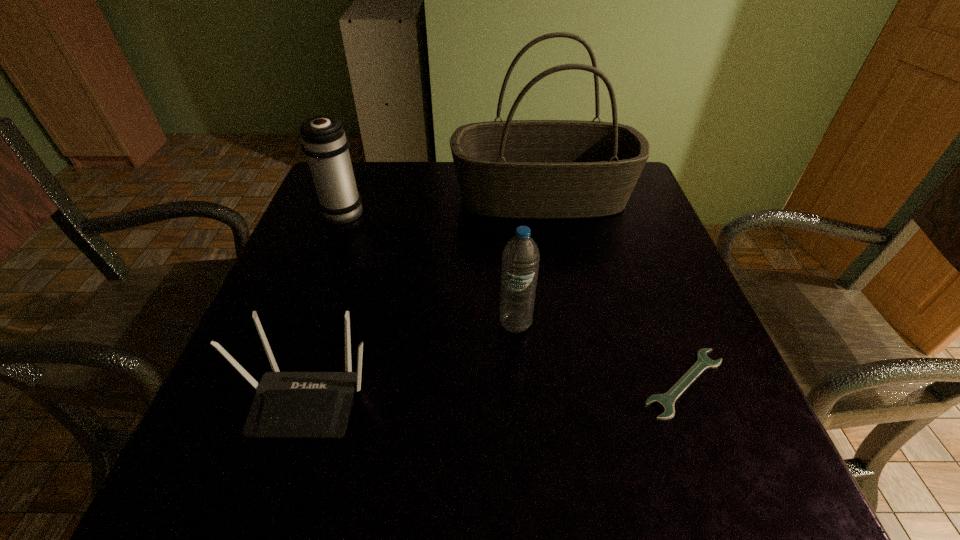
The image size is (960, 540). What are the coordinates of `free space located on the front-facing side of the router` in the screenshot? It's located at (283, 476).

You are a GUI agent. You are given a task and a screenshot of the screen. Output one action in this format:
    pyautogui.click(x=<x>, y=<y>)
    Task: Click on the vacant space located on the left of the wrench
    This screenshot has width=960, height=540.
    Given the screenshot: What is the action you would take?
    pyautogui.click(x=507, y=384)

Locate an element on the screen. Image resolution: width=960 pixels, height=540 pixels. basket at the far edge is located at coordinates (526, 169).

Locate an element on the screen. Image resolution: width=960 pixels, height=540 pixels. thermos bottle present at the far edge is located at coordinates (324, 142).

Identify the location of object that is positioned at the near edge. (286, 404).

Identify the location of thermos bottle at the left edge. (324, 142).

This screenshot has height=540, width=960. What are the coordinates of `router that is at the left edge` in the screenshot? It's located at (286, 404).

In order to click on basket that is positioned at the right edge in this screenshot , I will do `click(526, 169)`.

Find the location of `wrench positioned at the right edge`. wrench positioned at the right edge is located at coordinates (665, 401).

The height and width of the screenshot is (540, 960). In order to click on object present at the far left corner in this screenshot , I will do `click(324, 142)`.